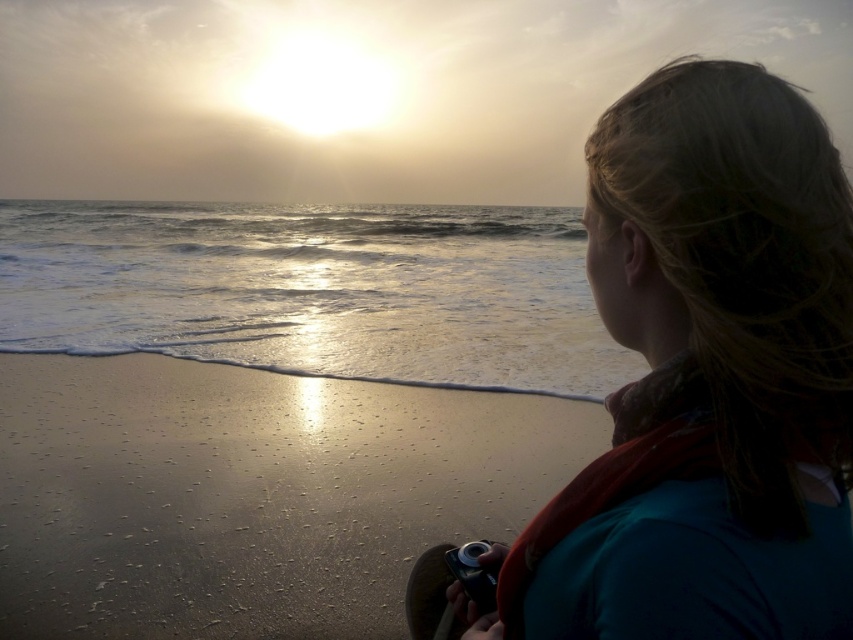
Question: Where is sandy beach at lower left located in relation to black plastic camera at lower center in the image?

Choices:
 (A) right
 (B) left

Answer: (B)

Question: Which point appears farthest from the camera in this image?

Choices:
 (A) (0, 529)
 (B) (466, 548)

Answer: (A)

Question: Which point appears farthest from the camera in this image?

Choices:
 (A) (514, 476)
 (B) (485, 550)

Answer: (A)

Question: From the image, what is the correct spatial relationship of teal fabric shirt at center in relation to black plastic camera at lower center?

Choices:
 (A) below
 (B) above

Answer: (B)

Question: Which point is closer to the camera?

Choices:
 (A) teal fabric shirt at center
 (B) black plastic camera at lower center
 (C) sandy beach at lower left

Answer: (A)

Question: Does sandy beach at lower left appear under black plastic camera at lower center?

Choices:
 (A) no
 (B) yes

Answer: (B)